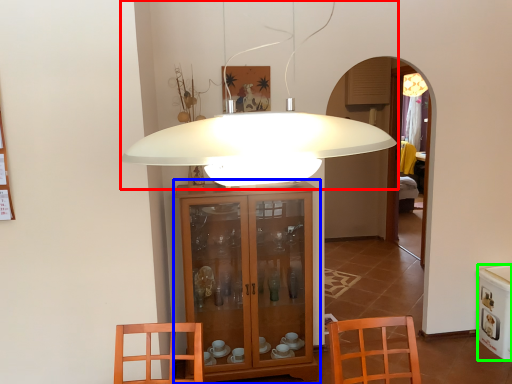
Question: Estimate the real-world distances between objects in this image. Which object is closer to lamp (highlighted by a red box), cabinetry (highlighted by a blue box) or appliance (highlighted by a green box)?

Choices:
 (A) cabinetry
 (B) appliance

Answer: (A)